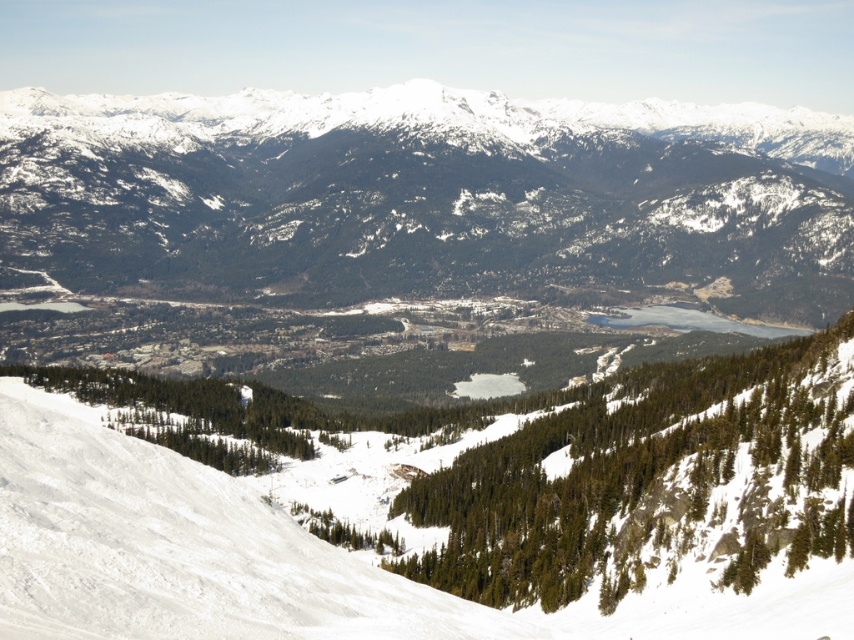
Question: Is snowy forested mountain at center smaller than white snow ski slope at lower left?

Choices:
 (A) yes
 (B) no

Answer: (B)

Question: Does snowy forested mountain at center have a lesser width compared to white snow ski slope at lower left?

Choices:
 (A) no
 (B) yes

Answer: (A)

Question: Which point is closer to the camera taking this photo?

Choices:
 (A) pyautogui.click(x=178, y=572)
 (B) pyautogui.click(x=420, y=204)

Answer: (A)

Question: Can you confirm if snowy forested mountain at center is positioned to the left of white snow ski slope at lower left?

Choices:
 (A) no
 (B) yes

Answer: (A)